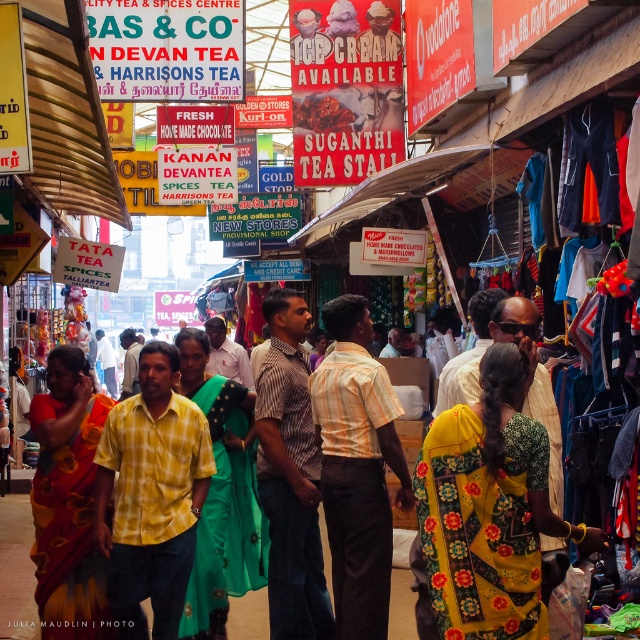
You are a customer in the market and you want to find the yellow checkered shirt at center and the yellow cotton saree at center. Which one is shorter in height?

The yellow checkered shirt at center has a lesser height compared to the yellow cotton saree at center, so the yellow checkered shirt at center is shorter.

You are a customer in this market and want to buy both the yellow checkered shirt at center and the yellow cotton saree at center. If you are standing at the entrance of the market, which item would you reach first, considering their positions?

The yellow checkered shirt at center and the yellow cotton saree at center are both at the center of the image, so they are equidistant from the entrance. However, according to the description, the yellow checkered shirt at center is 1.46 meters away from the yellow cotton saree at center, meaning they are positioned side by side or very close to each other. Since they are both at the center, you would reach them at the same time.

You are standing at the entrance of the market and see a person wearing a yellow checkered shirt at center. Based on the coordinates provided, is the shirt located closer to the left or right side of the image?

The yellow checkered shirt at center is located at point 0.777 on the x axis and 0.237 on the y axis. Since the x coordinate is closer to 1, the shirt is positioned more to the right side of the image.